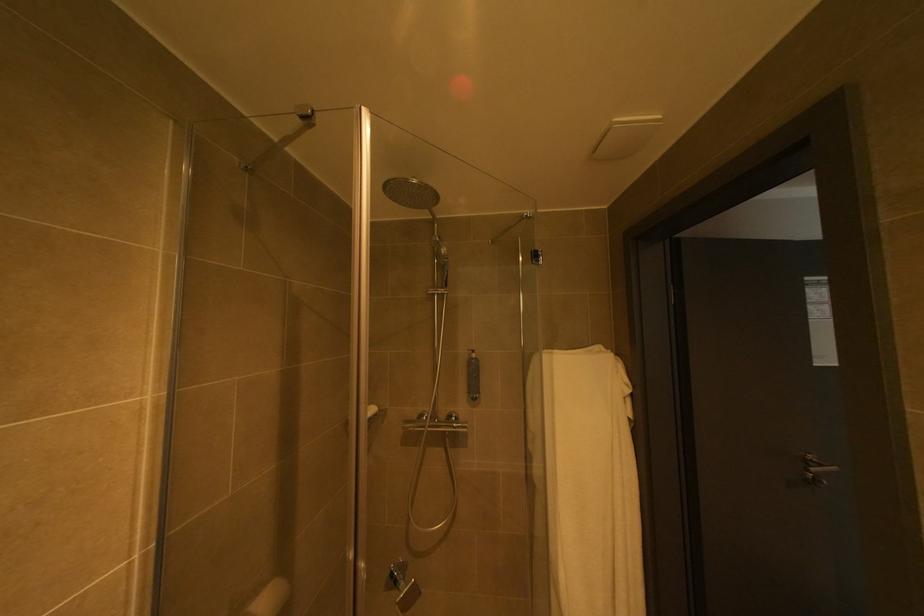
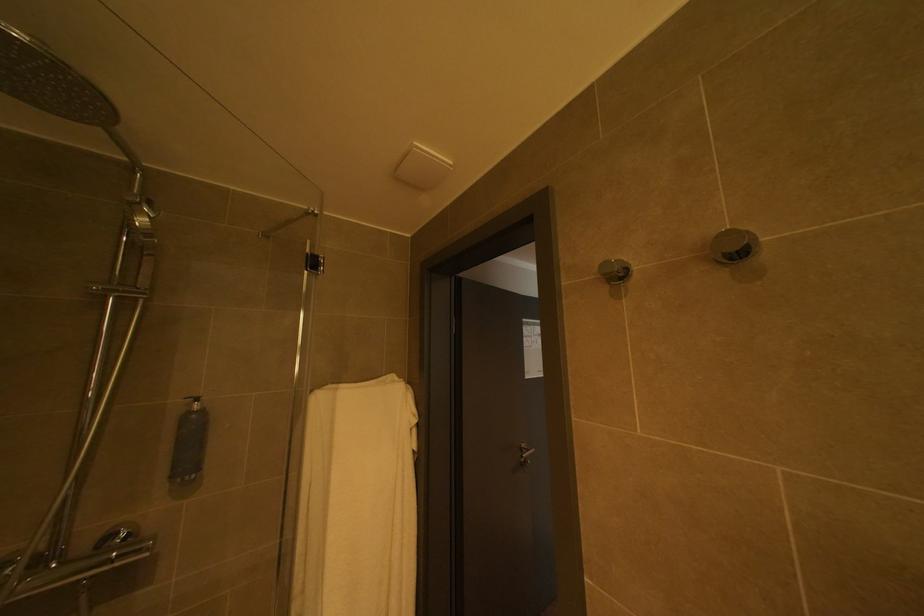
In the second image, find the point that corresponds to the point at 480,394 in the first image.

(184, 477)